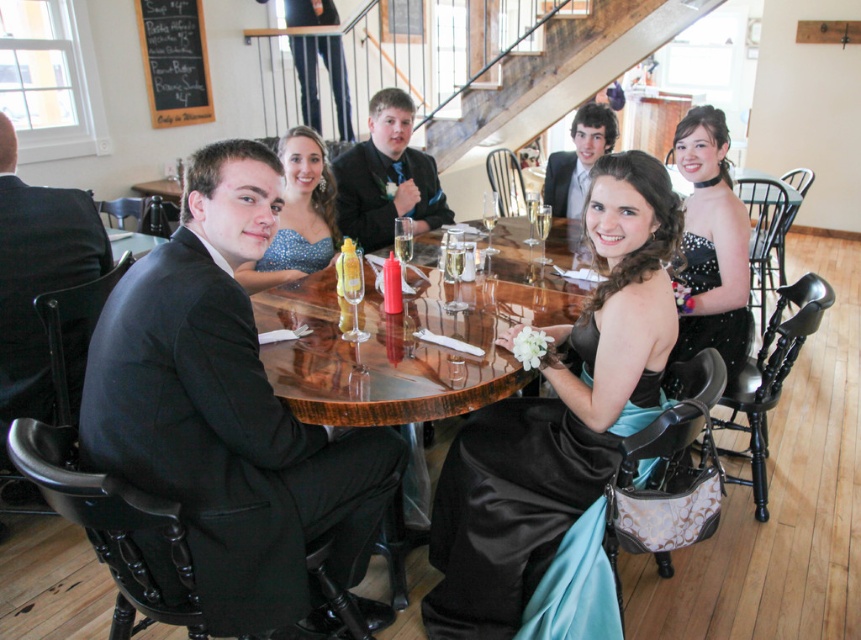
You are a guest at this event and want to read the black chalkboard menu at upper left while sipping your translucent glass wine at table center. Can you do both at the same time without moving your head?

The black chalkboard menu at upper left is located above the translucent glass wine at table center, so you can look up to see the menu while keeping your wine within reach. Yes, you can do both without moving your head.

You are a photographer standing at the back of the banquet hall. You want to take a closeup shot of the satin black dress at center. Considering your current position, can you estimate if you need to move closer or farther away to focus on the dress?

The satin black dress at center is 1.74 meters away from viewer. Since you are currently at the back of the banquet hall, you need to move closer to the dress to take a closeup shot.

You are a photographer at the event and need to capture a photo where both the black satin dress at center and the matte black suit at center are visible. Based on their heights, which one might appear more prominent in the photo?

The black satin dress at center is much taller than the matte black suit at center, so it will appear more prominent in the photo.